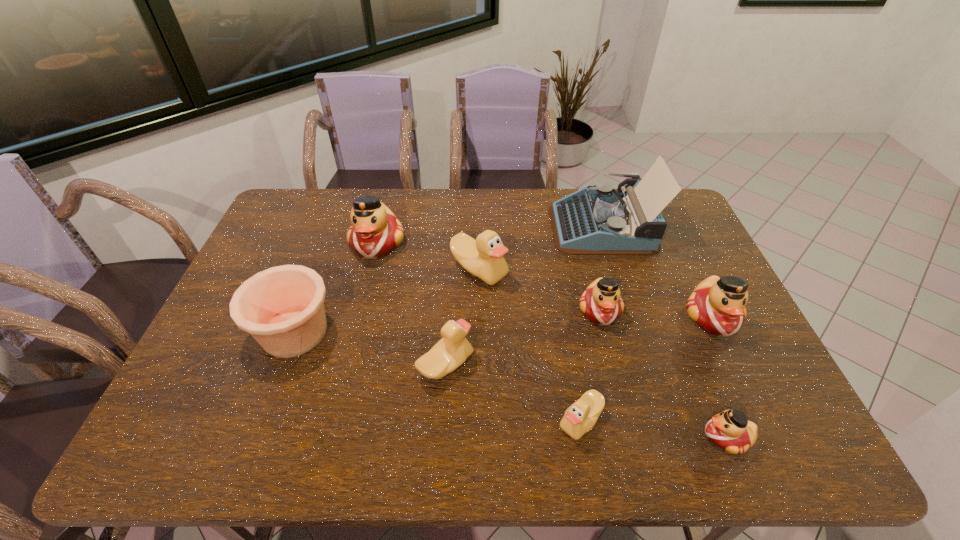
Locate an element on the screen. The width and height of the screenshot is (960, 540). vacant area that satisfies the following two spatial constraints: 1. on the typing side of the typewriter; 2. at the beak of the farthest beige duck is located at coordinates (616, 270).

The height and width of the screenshot is (540, 960). Find the location of `vacant space that satisfies the following two spatial constraints: 1. on the face of the second biggest red duck; 2. on the face of the smallest red duck`. vacant space that satisfies the following two spatial constraints: 1. on the face of the second biggest red duck; 2. on the face of the smallest red duck is located at coordinates (770, 437).

Identify the location of blank area in the image that satisfies the following two spatial constraints: 1. on the typing side of the typewriter; 2. on the face of the leftmost duck. Image resolution: width=960 pixels, height=540 pixels. (608, 244).

Where is `vacant area in the image that satisfies the following two spatial constraints: 1. on the face of the second smallest red duck; 2. at the beak of the rightmost beige duck`? The width and height of the screenshot is (960, 540). vacant area in the image that satisfies the following two spatial constraints: 1. on the face of the second smallest red duck; 2. at the beak of the rightmost beige duck is located at coordinates (628, 421).

Locate an element on the screen. free point that satisfies the following two spatial constraints: 1. on the face of the second smallest red duck; 2. at the beak of the second nearest beige duck is located at coordinates (613, 365).